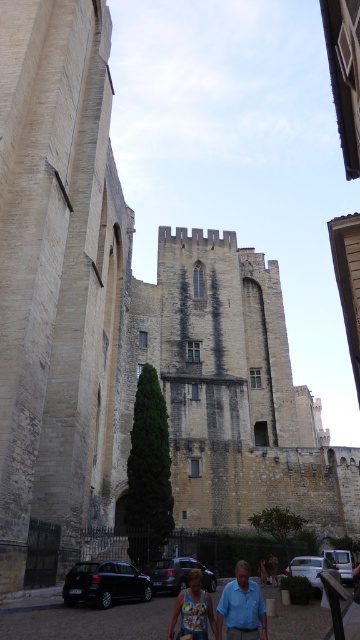
Question: Which of the following is the farthest from the observer?

Choices:
 (A) blue cotton shirt at lower center
 (B) printed fabric tank top at lower center
 (C) blue denim jeans at lower center

Answer: (C)

Question: Is blue cotton shirt at lower center behind printed fabric tank top at lower center?

Choices:
 (A) no
 (B) yes

Answer: (A)

Question: Which point is farther to the camera?

Choices:
 (A) (168, 625)
 (B) (262, 560)
 (C) (254, 616)

Answer: (B)

Question: Which object is farther from the camera taking this photo?

Choices:
 (A) printed fabric tank top at lower center
 (B) blue cotton shirt at lower center

Answer: (A)

Question: Does blue cotton shirt at lower center appear on the left side of printed fabric tank top at lower center?

Choices:
 (A) yes
 (B) no

Answer: (B)

Question: Considering the relative positions of blue cotton shirt at lower center and blue denim jeans at lower center in the image provided, where is blue cotton shirt at lower center located with respect to blue denim jeans at lower center?

Choices:
 (A) above
 (B) below

Answer: (A)